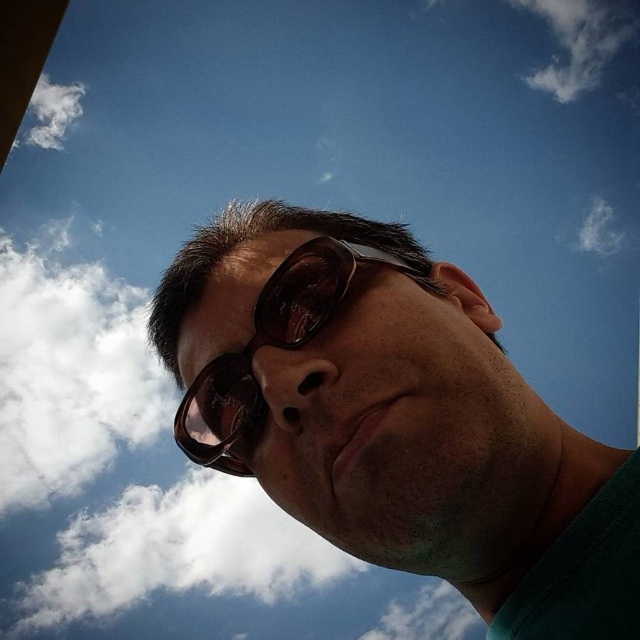
You are a photographer trying to capture a portrait of the person in the scene. You notice the matte black sunglasses at center and the white fluffy cloud at upper right. Which object appears smaller in the photo?

The matte black sunglasses at center appears smaller in the photo because it has a lesser height compared to the white fluffy cloud at upper right.

You are holding a camera and want to take a photo of the point at coordinates (509,516) in the scene. The camera has a minimum focus distance of 40 inches. Will the camera be able to focus on the point?

The distance of point (509,516) from the camera is 38.59 inches, which is less than the camera minimum focus distance of 40 inches. Therefore, the camera will not be able to focus on the point.

You are a photographer trying to capture the reflection of the white fluffy cloud at upper left in the matte black sunglasses at center. Given the size of the sunglasses, do you think the entire cloud will fit within the reflection?

The matte black sunglasses at center are narrower than the white fluffy cloud at upper left, so the entire cloud may not fit within the reflection.